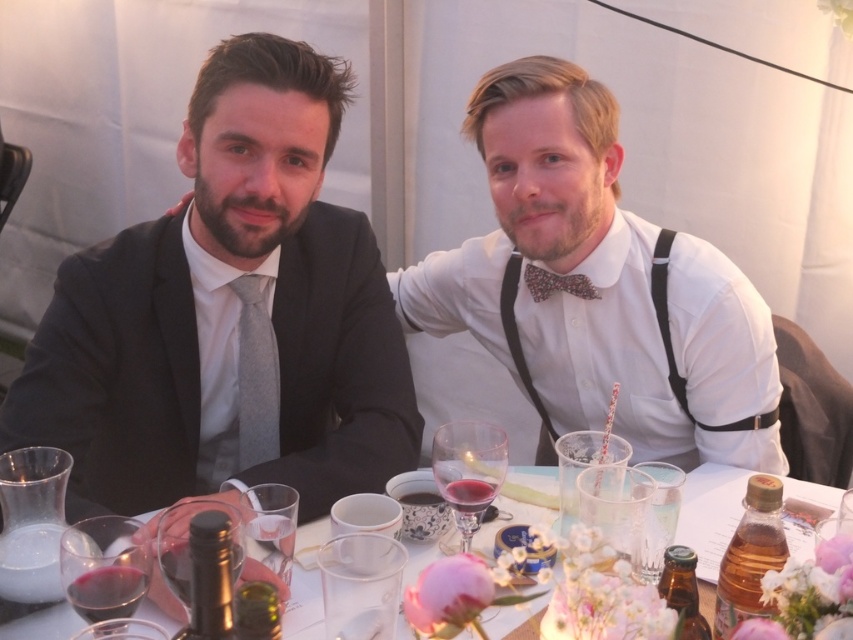
Which of these two, translucent glass wine glass at lower left or gray matte tie at left, stands taller?

With more height is gray matte tie at left.

Is point (112, 592) closer to viewer compared to point (264, 328)?

Yes.

Locate an element on the screen. The width and height of the screenshot is (853, 640). translucent glass wine glass at lower left is located at coordinates (103, 566).

This screenshot has height=640, width=853. Describe the element at coordinates (468, 470) in the screenshot. I see `transparent glass wine glass at center` at that location.

Image resolution: width=853 pixels, height=640 pixels. What do you see at coordinates (468, 470) in the screenshot?
I see `transparent glass wine glass at center` at bounding box center [468, 470].

Identify the location of transparent glass wine glass at center. (468, 470).

Based on the photo, between translucent glass wine glass at lower left and floral-patterned fabric bow tie at center, which one is positioned higher?

floral-patterned fabric bow tie at center

Is translucent glass wine glass at lower left taller than floral-patterned fabric bow tie at center?

Yes.

What do you see at coordinates (103, 566) in the screenshot?
I see `translucent glass wine glass at lower left` at bounding box center [103, 566].

At what (x,y) coordinates should I click in order to perform the action: click on translucent glass wine glass at lower left. Please return your answer as a coordinate pair (x, y). The width and height of the screenshot is (853, 640). Looking at the image, I should click on (103, 566).